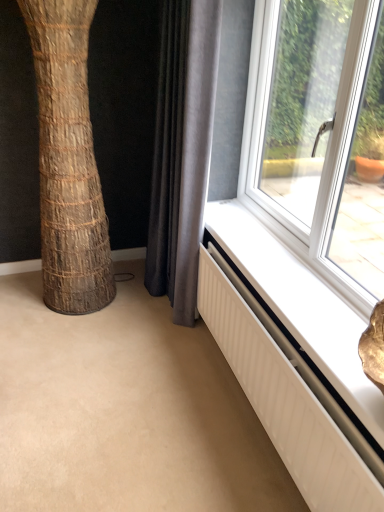
Question: Can you confirm if white textured radiator at lower right is smaller than gray fabric curtain at lower center?

Choices:
 (A) no
 (B) yes

Answer: (B)

Question: Can you confirm if white textured radiator at lower right is taller than gray fabric curtain at lower center?

Choices:
 (A) yes
 (B) no

Answer: (B)

Question: Does white textured radiator at lower right have a lesser width compared to gray fabric curtain at lower center?

Choices:
 (A) no
 (B) yes

Answer: (B)

Question: Is white textured radiator at lower right outside of gray fabric curtain at lower center?

Choices:
 (A) yes
 (B) no

Answer: (A)

Question: From a real-world perspective, is white textured radiator at lower right beneath gray fabric curtain at lower center?

Choices:
 (A) no
 (B) yes

Answer: (B)

Question: From the image's perspective, relative to gray fabric curtain at lower center, is white textured radiator at lower right above or below?

Choices:
 (A) above
 (B) below

Answer: (B)

Question: From their relative heights in the image, would you say white textured radiator at lower right is taller or shorter than gray fabric curtain at lower center?

Choices:
 (A) tall
 (B) short

Answer: (B)

Question: Relative to gray fabric curtain at lower center, is white textured radiator at lower right in front or behind?

Choices:
 (A) front
 (B) behind

Answer: (A)

Question: Considering the positions of point (360, 473) and point (182, 236), is point (360, 473) closer or farther from the camera than point (182, 236)?

Choices:
 (A) closer
 (B) farther

Answer: (A)

Question: Based on their sizes in the image, would you say white textured radiator at lower right is bigger or smaller than brown textured tree trunk at left?

Choices:
 (A) big
 (B) small

Answer: (B)

Question: Would you say white textured radiator at lower right is to the left or to the right of brown textured tree trunk at left in the picture?

Choices:
 (A) right
 (B) left

Answer: (A)

Question: Choose the correct answer: Is white textured radiator at lower right inside brown textured tree trunk at left or outside it?

Choices:
 (A) outside
 (B) inside

Answer: (A)

Question: Is white textured radiator at lower right taller or shorter than brown textured tree trunk at left?

Choices:
 (A) tall
 (B) short

Answer: (B)

Question: Looking at their shapes, would you say brown textured tree trunk at left is wider or thinner than white textured radiator at lower right?

Choices:
 (A) wide
 (B) thin

Answer: (A)

Question: Looking at the image, does brown textured tree trunk at left seem bigger or smaller compared to white textured radiator at lower right?

Choices:
 (A) small
 (B) big

Answer: (B)